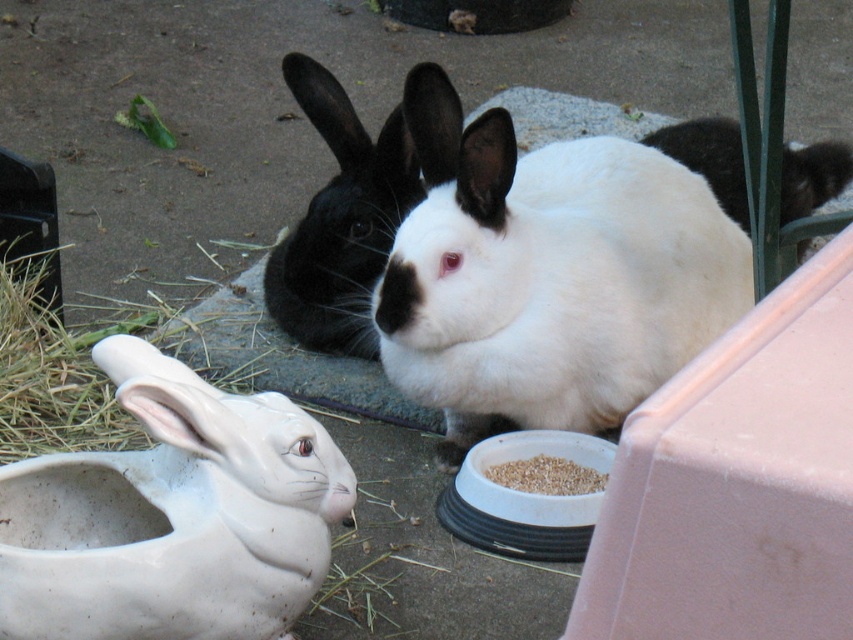
Question: Can you confirm if white matte ceramic rabbit at lower left is positioned to the left of white fur at center?

Choices:
 (A) yes
 (B) no

Answer: (A)

Question: Which point is closer to the camera taking this photo?

Choices:
 (A) (276, 433)
 (B) (392, 237)
 (C) (717, 298)

Answer: (A)

Question: Among these points, which one is farthest from the camera?

Choices:
 (A) (410, 204)
 (B) (813, 186)
 (C) (514, 484)
 (D) (500, 310)

Answer: (B)

Question: Which object is positioned closest to the brown grain at lower center?

Choices:
 (A) white fur at center
 (B) white soft fur rabbit at center

Answer: (B)

Question: Is white matte ceramic rabbit at lower left smaller than black matte rabbit at center?

Choices:
 (A) yes
 (B) no

Answer: (A)

Question: Does white matte ceramic rabbit at lower left have a smaller size compared to black matte rabbit at center?

Choices:
 (A) no
 (B) yes

Answer: (B)